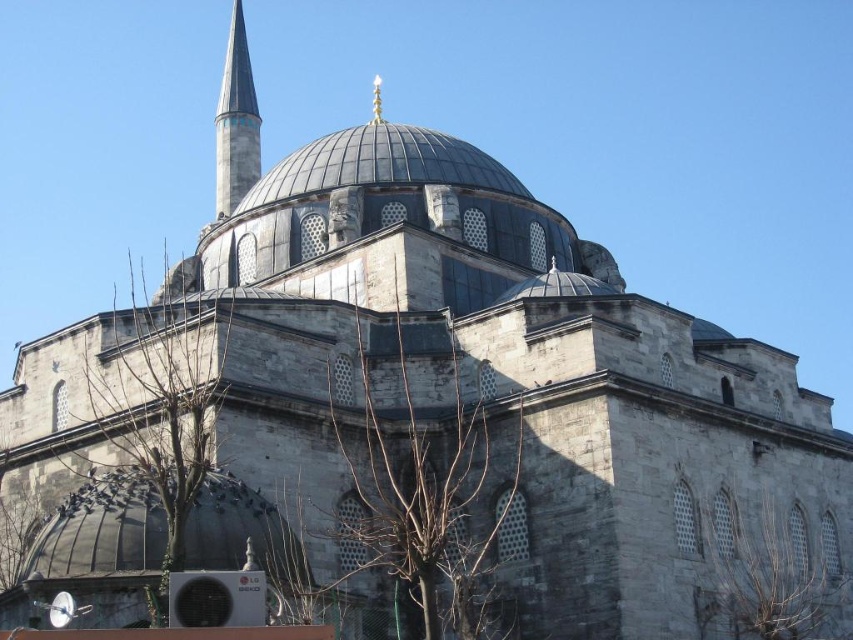
Question: Is gray stone dome at center positioned in front of smooth white minaret at upper left?

Choices:
 (A) no
 (B) yes

Answer: (B)

Question: Which point is farther to the camera?

Choices:
 (A) (218, 509)
 (B) (252, 96)

Answer: (B)

Question: Can you confirm if gray stone dome at center is smaller than smooth white minaret at upper left?

Choices:
 (A) no
 (B) yes

Answer: (B)

Question: Which point is closer to the camera?

Choices:
 (A) smooth white minaret at upper left
 (B) gray stone dome at center

Answer: (B)

Question: Which point appears farthest from the camera in this image?

Choices:
 (A) (242, 84)
 (B) (103, 500)

Answer: (A)

Question: Does gray stone dome at center appear under smooth white minaret at upper left?

Choices:
 (A) no
 (B) yes

Answer: (B)